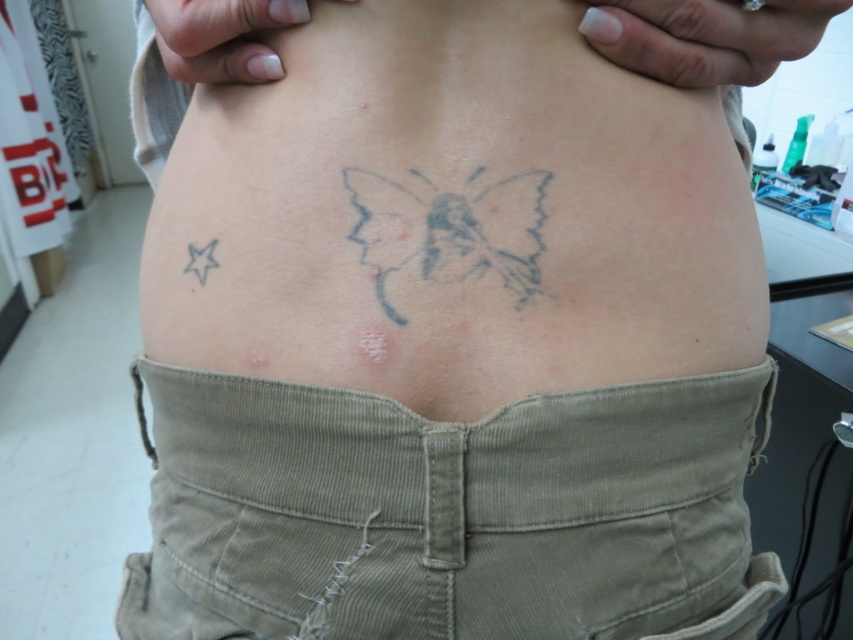
Is corduroy fabric at center bigger than gray ink butterfly at center?

Correct, corduroy fabric at center is larger in size than gray ink butterfly at center.

Who is positioned more to the left, corduroy fabric at center or gray ink butterfly at center?

corduroy fabric at center is more to the left.

Is point (236, 381) more distant than point (360, 237)?

Yes, it is.

Image resolution: width=853 pixels, height=640 pixels. I want to click on corduroy fabric at center, so click(450, 515).